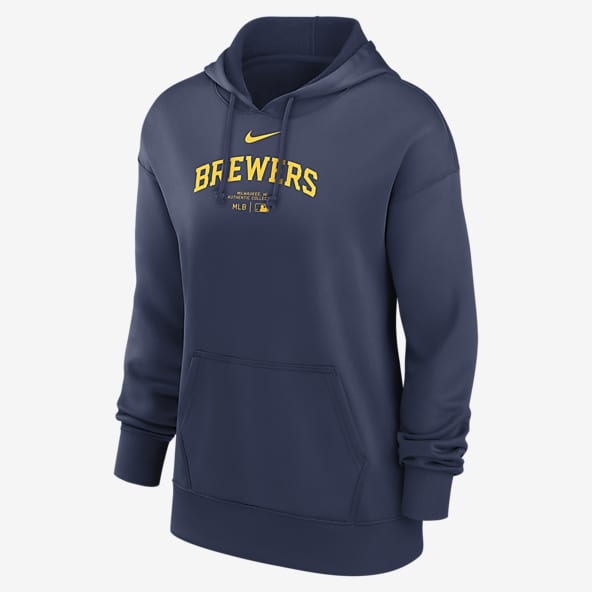
Find the location of a particular element. hood is located at coordinates (376, 54).